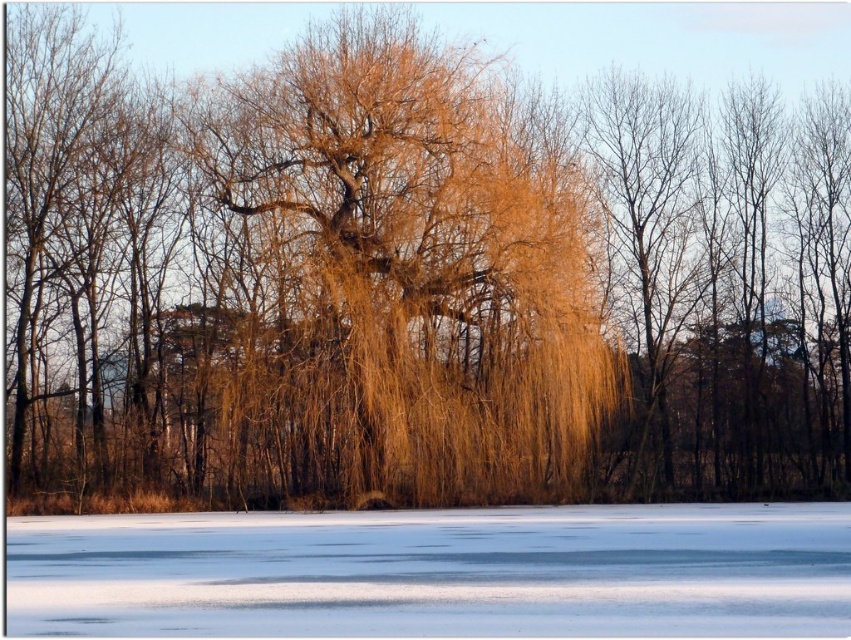
You are an ice skater standing on the white ice at lower center and want to reach the golden textured willow at center. Which direction should you move to get closer to it?

The golden textured willow at center is located above the white ice at lower center, so you should move upward to get closer to it.

You are an ice skater standing on the white ice at lower center and want to move towards the golden textured willow at center. Which direction should you skate to reach it?

The golden textured willow at center is positioned on the left side of white ice at lower center, so you should skate to the left to reach it.